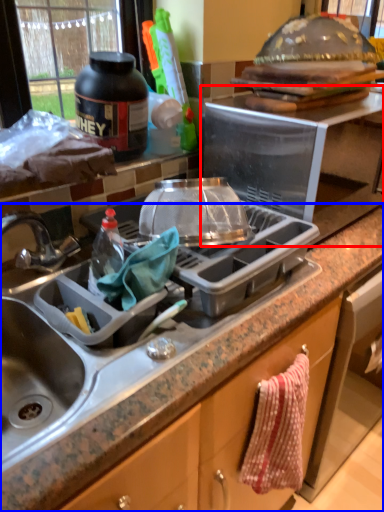
Question: Which object appears closest to the camera in this image, appliance (highlighted by a red box) or countertop (highlighted by a blue box)?

Choices:
 (A) appliance
 (B) countertop

Answer: (B)